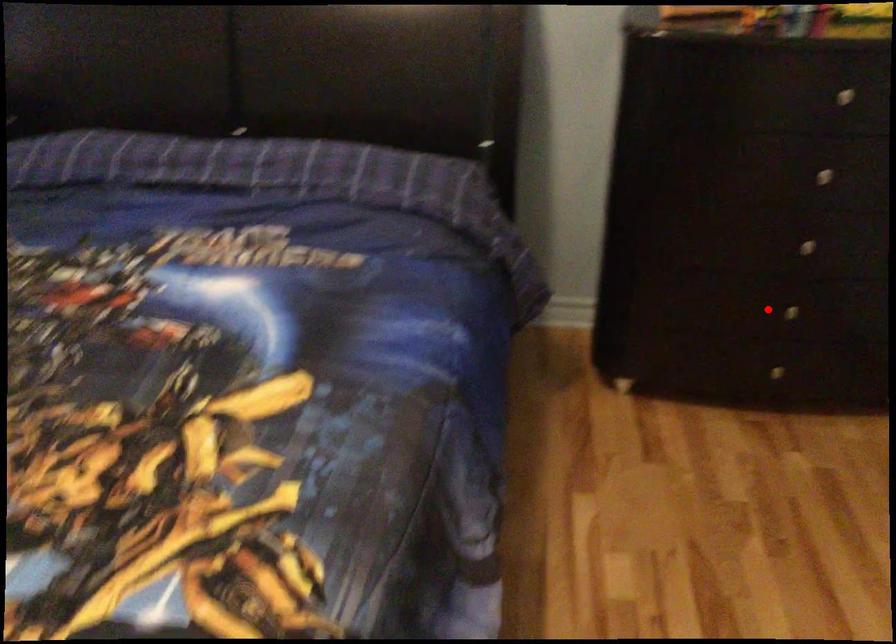
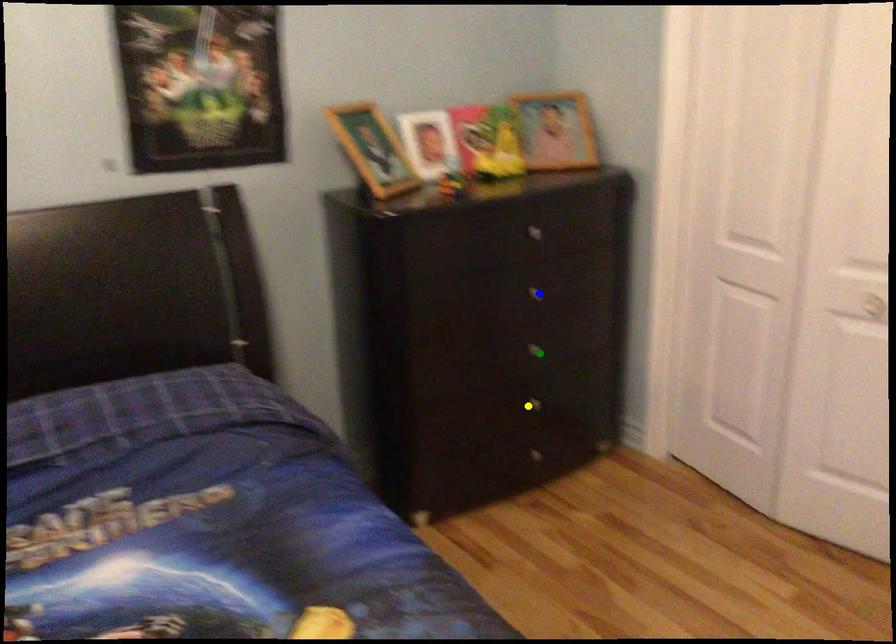
Question: I am providing you with two images of the same scene from different viewpoints. A red point is marked on the first image. You are given multiple points on the second image. Which point in image 2 is actually the same real-world point as the red point in image 1?

Choices:
 (A) blue point
 (B) green point
 (C) yellow point

Answer: (C)